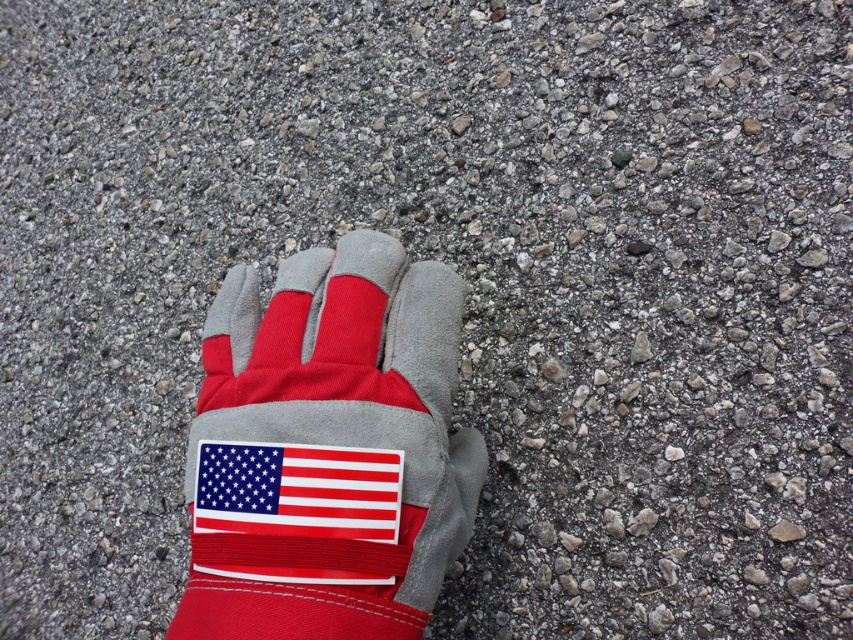
Is point (317, 378) positioned before point (279, 465)?

No, (317, 378) is further to viewer.

Can you confirm if red fabric/glove at center is taller than red fabric flag at center?

Yes, red fabric/glove at center is taller than red fabric flag at center.

Measure the distance between red fabric/glove at center and camera.

54.74 centimeters

You are a GUI agent. You are given a task and a screenshot of the screen. Output one action in this format:
    pyautogui.click(x=<x>, y=<y>)
    Task: Click on the red fabric/glove at center
    
    Given the screenshot: What is the action you would take?
    pyautogui.click(x=328, y=449)